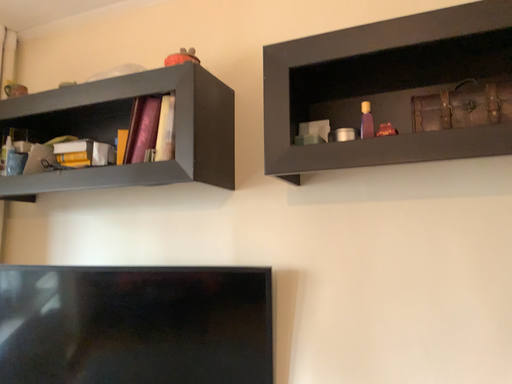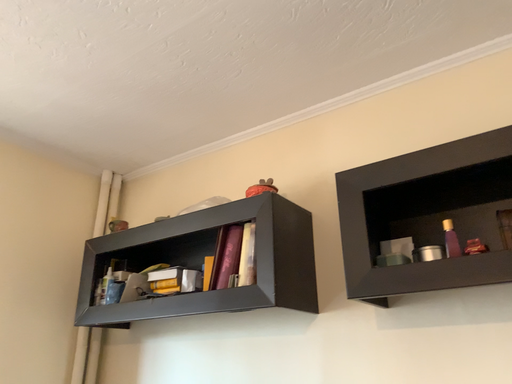
Question: How did the camera likely rotate when shooting the video?

Choices:
 (A) rotated left
 (B) rotated right

Answer: (A)